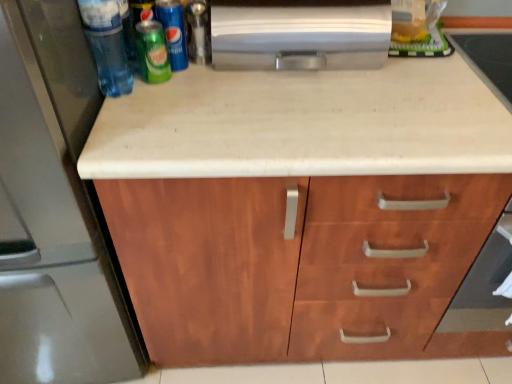
Where is `empty space that is to the right of translucent plastic bottle at upper left`? The image size is (512, 384). empty space that is to the right of translucent plastic bottle at upper left is located at coordinates (200, 98).